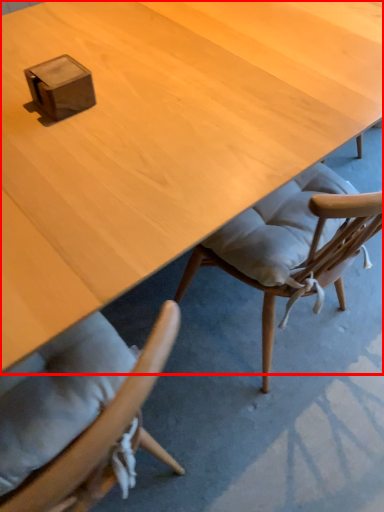
Question: In this image, where is desk (annotated by the red box) located relative to box?

Choices:
 (A) right
 (B) left

Answer: (A)